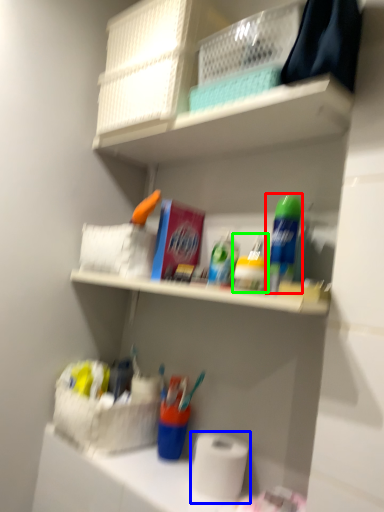
Question: Which object is positioned farthest from cleaning product (highlighted by a red box)? Select from toilet paper (highlighted by a blue box) and toiletry (highlighted by a green box).

Choices:
 (A) toilet paper
 (B) toiletry

Answer: (A)